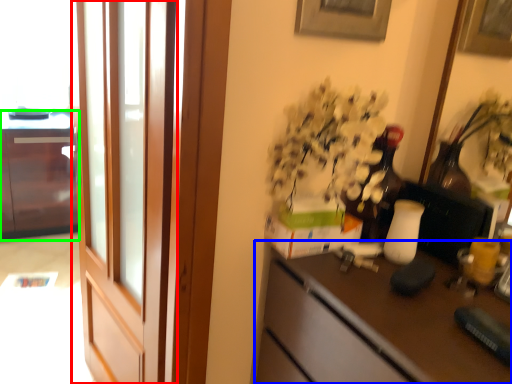
Question: Based on their relative distances, which object is nearer to screen door (highlighted by a red box)? Choose from desk (highlighted by a blue box) and cabinetry (highlighted by a green box).

Choices:
 (A) desk
 (B) cabinetry

Answer: (A)